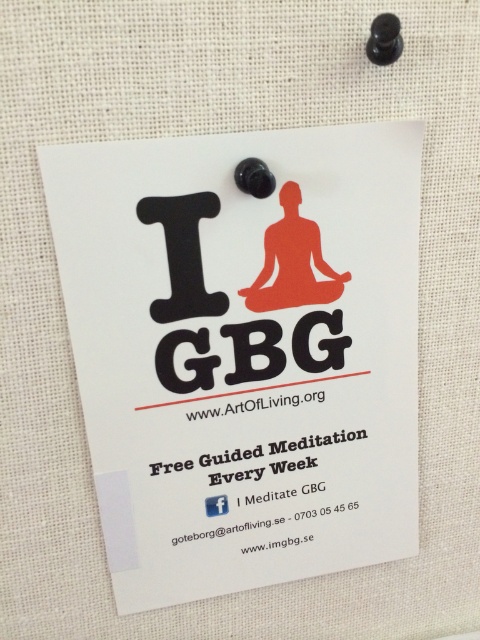
You are an artist standing in front of the white paper poster at center and the white matte facebook logo at center. You want to touch both with your paintbrush. Which object should you reach for first without moving your hand?

You should reach for the white paper poster at center first because it is closer to you than the white matte facebook logo at center.

You are standing in front of the white card pinned to the fabric surface. There are two points marked on the card. One is at position point (355, 378) and the other at point (211, 500). Which point is closer to you?

Point (355, 378) is in front of point (211, 500), so it is closer to you.